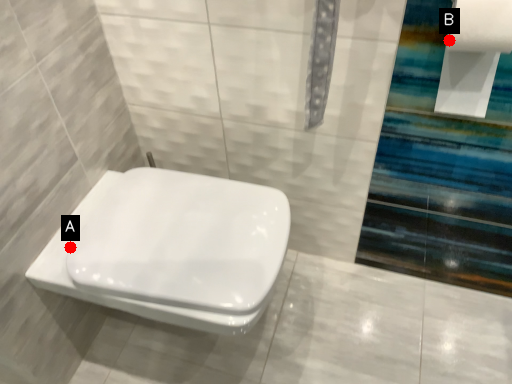
Question: Two points are circled on the image, labeled by A and B beside each circle. Which of the following is the farthest from the observer?

Choices:
 (A) A is further
 (B) B is further

Answer: (A)